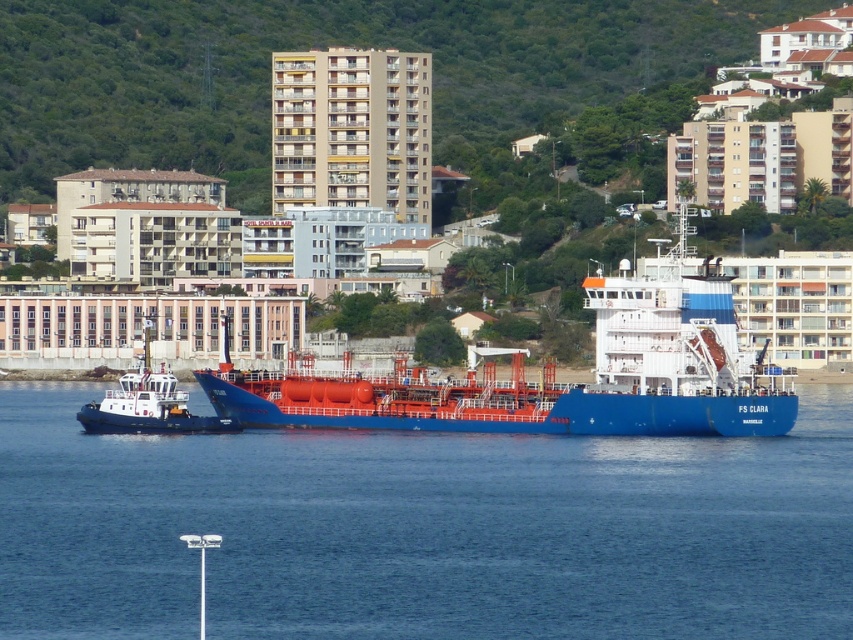
Question: Does blue water at center have a smaller size compared to white glossy tugboat at lower left?

Choices:
 (A) no
 (B) yes

Answer: (A)

Question: Which point is farther to the camera?

Choices:
 (A) blue water at center
 (B) white glossy tugboat at lower left

Answer: (B)

Question: Among these objects, which one is nearest to the camera?

Choices:
 (A) white glossy tugboat at lower left
 (B) blue water at center
 (C) blue matte ship at center

Answer: (B)

Question: Can you confirm if blue matte ship at center is positioned to the left of white glossy tugboat at lower left?

Choices:
 (A) no
 (B) yes

Answer: (A)

Question: Does blue matte ship at center appear over white glossy tugboat at lower left?

Choices:
 (A) yes
 (B) no

Answer: (A)

Question: Which object is positioned farthest from the blue matte ship at center?

Choices:
 (A) blue water at center
 (B) white glossy tugboat at lower left

Answer: (B)